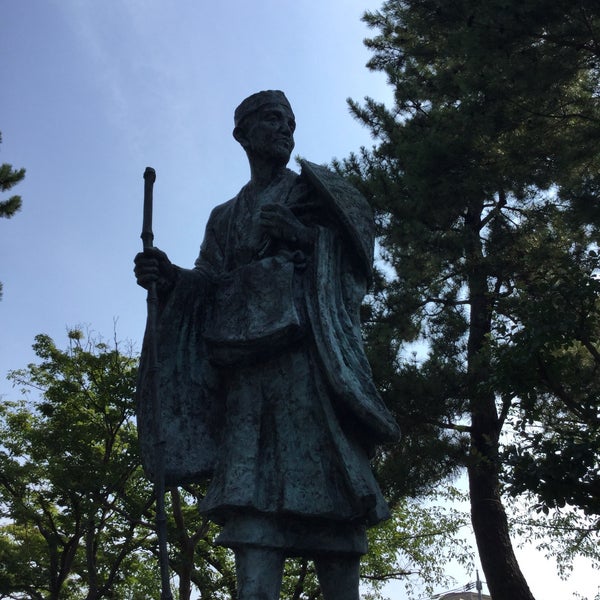
This screenshot has height=600, width=600. I want to click on wires, so click(458, 586), click(483, 582).